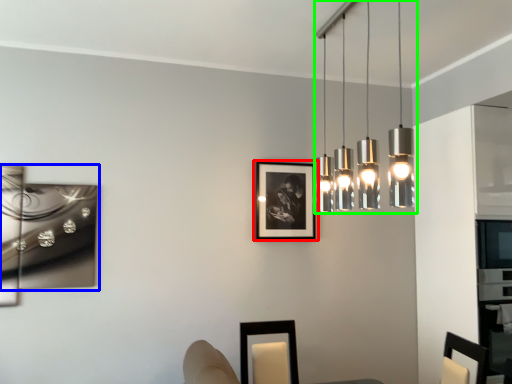
Question: Which object is positioned farthest from picture frame (highlighted by a red box)? Select from picture frame (highlighted by a blue box) and lamp (highlighted by a green box).

Choices:
 (A) picture frame
 (B) lamp

Answer: (A)